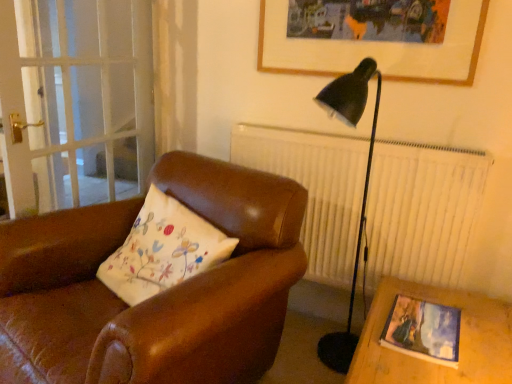
Question: Should I look upward or downward to see transparent glass screen door at left?

Choices:
 (A) up
 (B) down

Answer: (A)

Question: Considering the relative positions of matte wooden picture frame at lower right, acting as the 1th picture frame starting from the front, and brown leather chair at center in the image provided, is matte wooden picture frame at lower right, acting as the 1th picture frame starting from the front, to the left of brown leather chair at center from the viewer's perspective?

Choices:
 (A) no
 (B) yes

Answer: (A)

Question: Is matte wooden picture frame at lower right, acting as the 1th picture frame starting from the front, thinner than brown leather chair at center?

Choices:
 (A) no
 (B) yes

Answer: (B)

Question: Is the depth of matte wooden picture frame at lower right, the first picture frame when ordered from bottom to top, greater than that of brown leather chair at center?

Choices:
 (A) yes
 (B) no

Answer: (B)

Question: Is matte wooden picture frame at lower right, arranged as the second picture frame when viewed from the back, oriented towards brown leather chair at center?

Choices:
 (A) no
 (B) yes

Answer: (B)

Question: Is matte wooden picture frame at lower right, acting as the 1th picture frame starting from the front, completely or partially outside of brown leather chair at center?

Choices:
 (A) no
 (B) yes

Answer: (B)

Question: Is matte wooden picture frame at lower right, which ranks as the 2th picture frame in top-to-bottom order, turned away from brown leather chair at center?

Choices:
 (A) yes
 (B) no

Answer: (B)

Question: Does matte wooden picture frame at lower right, which ranks as the 2th picture frame in top-to-bottom order, lie behind transparent glass screen door at left?

Choices:
 (A) yes
 (B) no

Answer: (B)

Question: Is matte wooden picture frame at lower right, the first picture frame when ordered from bottom to top, smaller than transparent glass screen door at left?

Choices:
 (A) yes
 (B) no

Answer: (A)

Question: Are matte wooden picture frame at lower right, which ranks as the 2th picture frame in top-to-bottom order, and transparent glass screen door at left located far from each other?

Choices:
 (A) no
 (B) yes

Answer: (B)

Question: Does matte wooden picture frame at lower right, arranged as the second picture frame when viewed from the back, have a lesser width compared to transparent glass screen door at left?

Choices:
 (A) no
 (B) yes

Answer: (A)

Question: Is matte wooden picture frame at lower right, arranged as the second picture frame when viewed from the back, oriented away from transparent glass screen door at left?

Choices:
 (A) no
 (B) yes

Answer: (A)

Question: From a real-world perspective, is matte wooden picture frame at lower right, acting as the 1th picture frame starting from the front, located beneath transparent glass screen door at left?

Choices:
 (A) yes
 (B) no

Answer: (A)

Question: Is the surface of wooden picture frame at upper center, which is the 1th picture frame from top to bottom, in direct contact with brown leather chair at center?

Choices:
 (A) no
 (B) yes

Answer: (A)